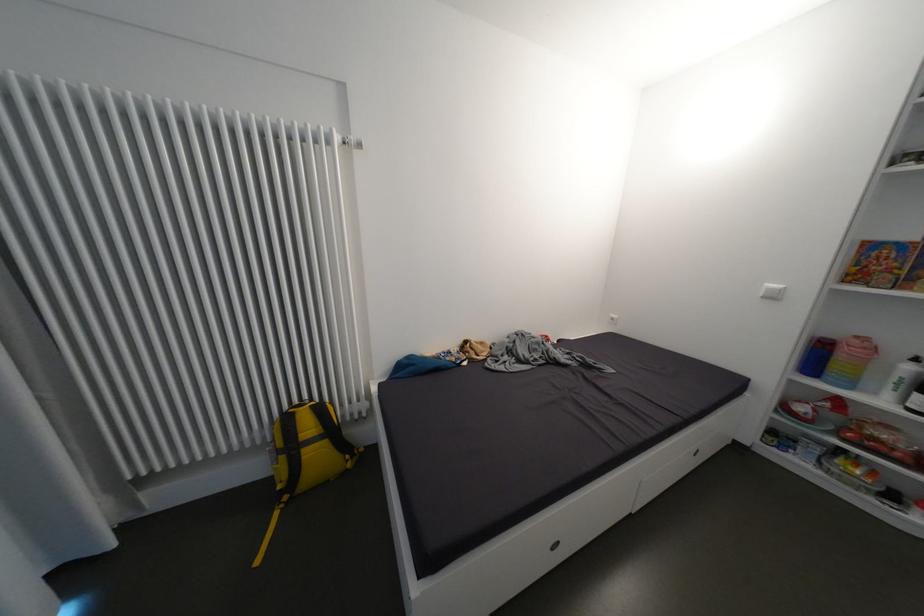
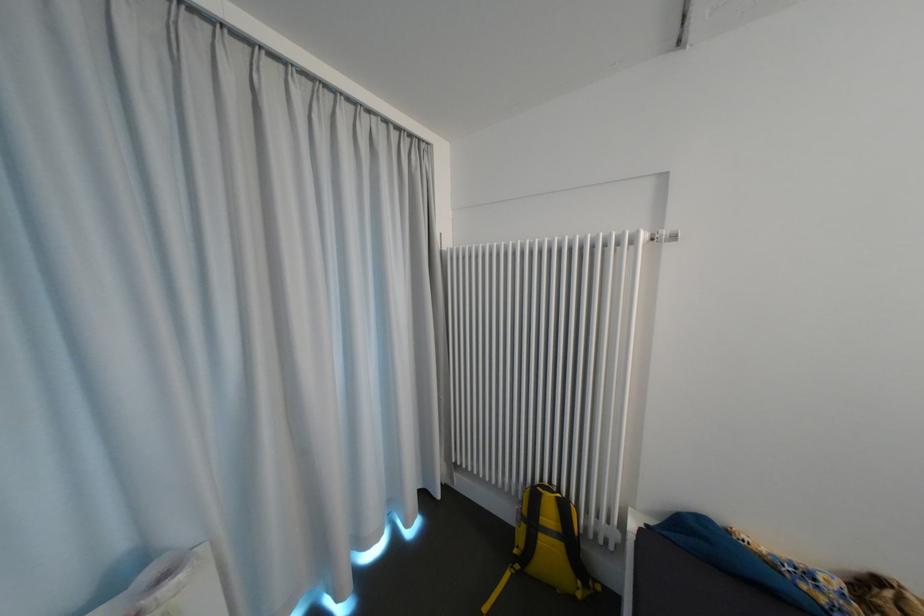
Locate, in the second image, the point that corresponds to point (363, 453) in the first image.

(599, 586)